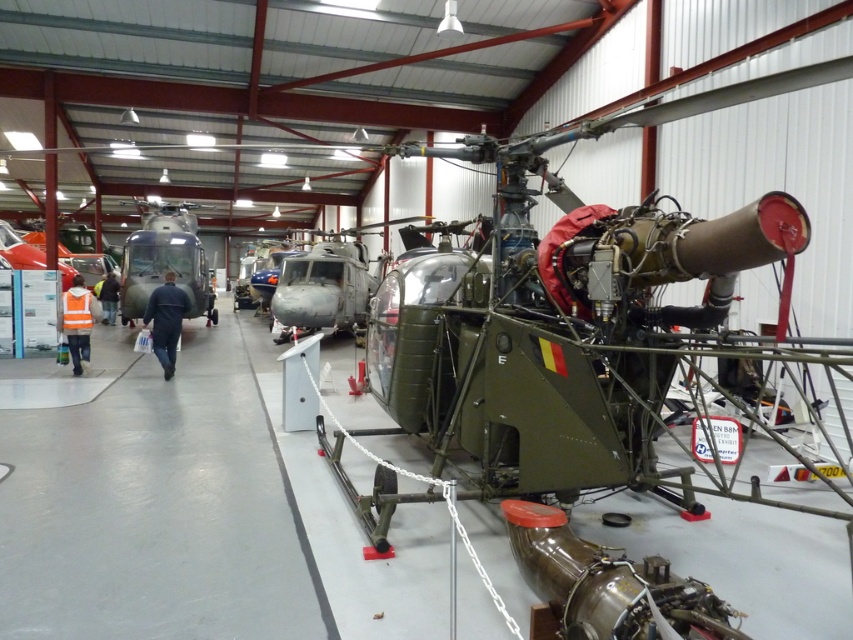
You are a technician who needs to inspect both helicopters. Which helicopter, the metallic gray helicopter at center or the matte black helicopter at center, requires a taller ladder for inspection due to its height?

The metallic gray helicopter at center requires a taller ladder for inspection because it is much taller than the matte black helicopter at center.

You are a military technician who needs to access the engine of the metallic gray helicopter at center and the matte black helicopter at center. Which helicopter is closer to the entrance located on the left side of the hangar?

The matte black helicopter at center is closer to the entrance located on the left side of the hangar because the metallic gray helicopter at center is positioned to its right.